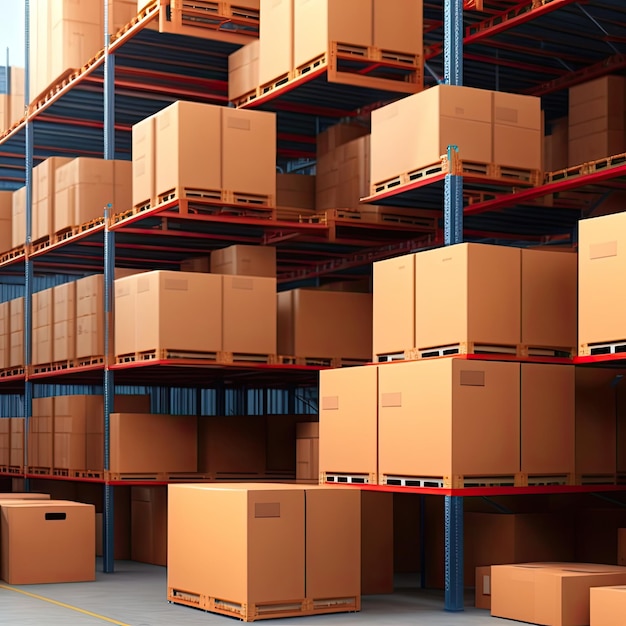
Locate an element on the screen. This screenshot has width=626, height=626. boxes on the floor only is located at coordinates tap(516, 591), tap(481, 582), tap(486, 531), tap(380, 530), tap(273, 526), tap(146, 516), tap(62, 521), tap(22, 488), tap(116, 506).